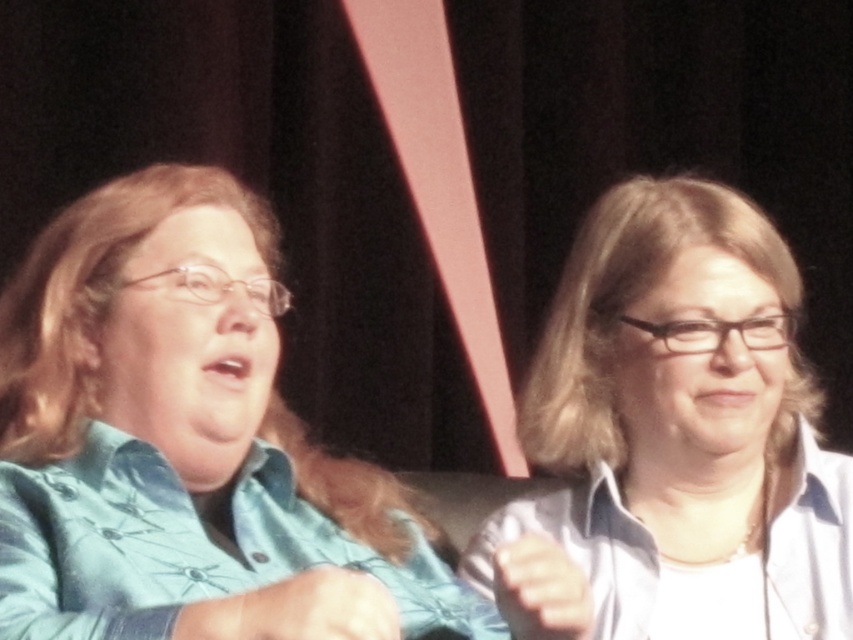
You are a photographer at a formal event and want to capture a closeup of the teal fabric shirt at left. The camera you are using has a focus point at coordinate point (184, 444). Will this focus point be effective for capturing the teal fabric shirt at left?

The teal fabric shirt at left is located at point (184, 444), so yes, the focus point at coordinate point (184, 444) will effectively capture the teal fabric shirt at left since it is precisely positioned there.

You are a photographer at a formal event. You need to capture a photo of both the teal fabric shirt at left and the white glossy shirt at upper right in the frame. Which shirt should you adjust your camera focus to prioritize if you want to ensure the wider subject is properly framed?

The teal fabric shirt at left is wider than the white glossy shirt at upper right, so you should prioritize focusing on the teal fabric shirt at left to ensure proper framing of the wider subject.

You are a photographer at a formal event. You want to take a photo of the teal fabric shirt at left and the white glossy shirt at upper right. The minimum distance your camera can focus on two subjects clearly is 10 inches. Can you capture both shirts in focus without adjusting your camera settings?

The teal fabric shirt at left and white glossy shirt at upper right are 11.16 inches apart. Since the distance between them is greater than the camera minimum focus requirement of 10 inches, you can capture both shirts in focus without adjusting your camera settings.